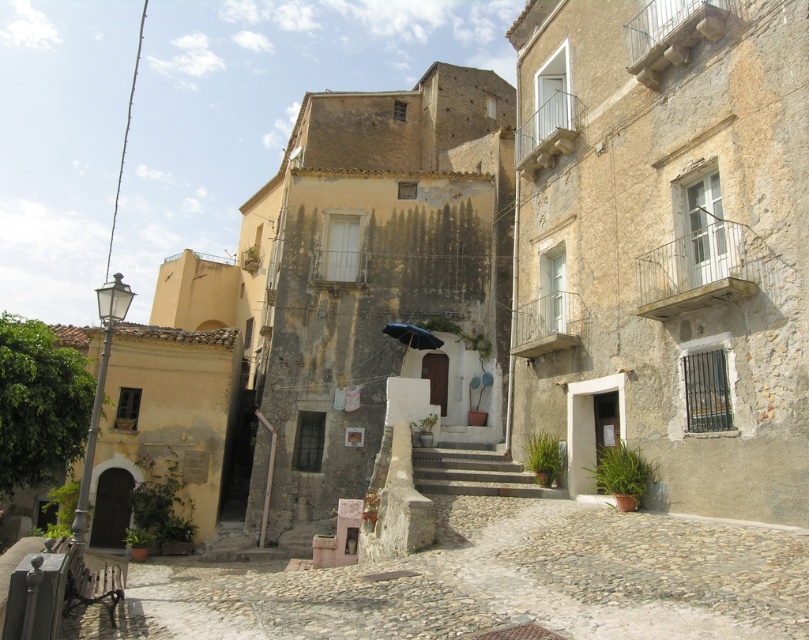
You are a tourist standing on the cobblestone street and want to take a photo of the historic buildings. You notice the smooth stone stairs at center and the black matte umbrella at center. Which object should you position to your left to frame the buildings properly?

To frame the buildings properly, you should position the black matte umbrella at center to your left since the smooth stone stairs at center is to the right of it, aligning them correctly in the photo.

You are standing on the cobblestone street and want to enter the central building. The door is partially hidden by the black matte umbrella at center. To reach the door, you need to climb the smooth stone stairs at center. Which object should you approach first?

You should approach the smooth stone stairs at center first because they are closer to you than the black matte umbrella at center, allowing you to reach the door more directly.

In the scene shown: You are standing on the cobblestone street in the historic village. You want to reach a specific location marked by the point at coordinates (443,468). Given that the average walking speed is 3 feet per second, how many seconds will it take you to reach that point from your current position?

The point at coordinates (443,468) is 145.19 feet away from the camera. At an average walking speed of 3 feet per second, it would take approximately 48.396 seconds to reach that point. Rounded to the nearest whole number, this is about 48 seconds.